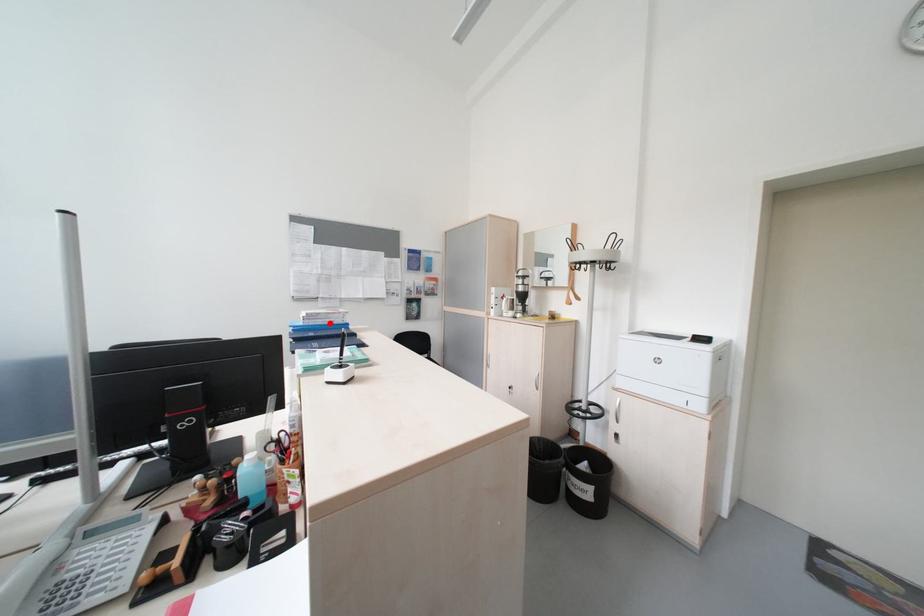
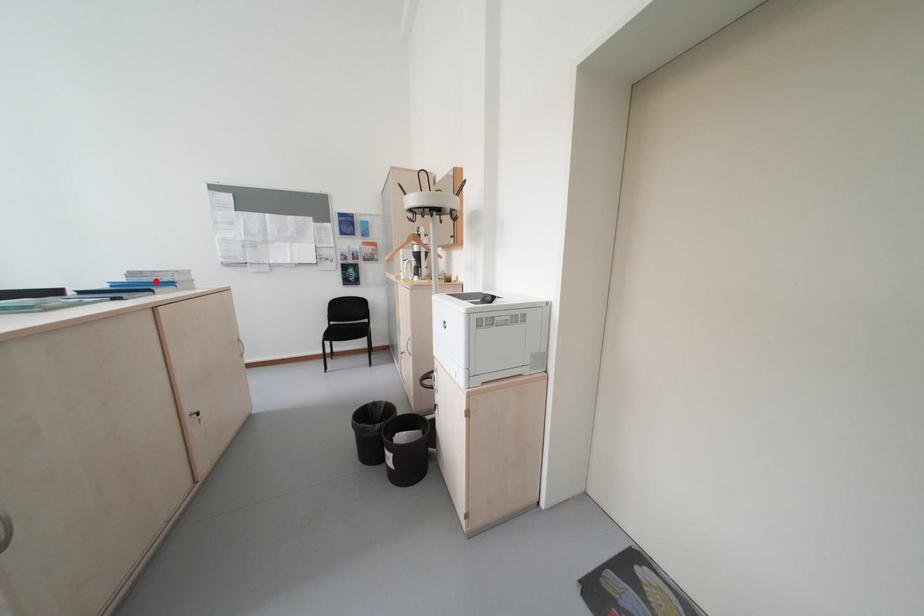
I am providing you with two images of the same scene from different viewpoints. A red point is marked on the first image and another point is marked on the second image. Are the points marked in image1 and image2 representing the same 3D position?

Yes